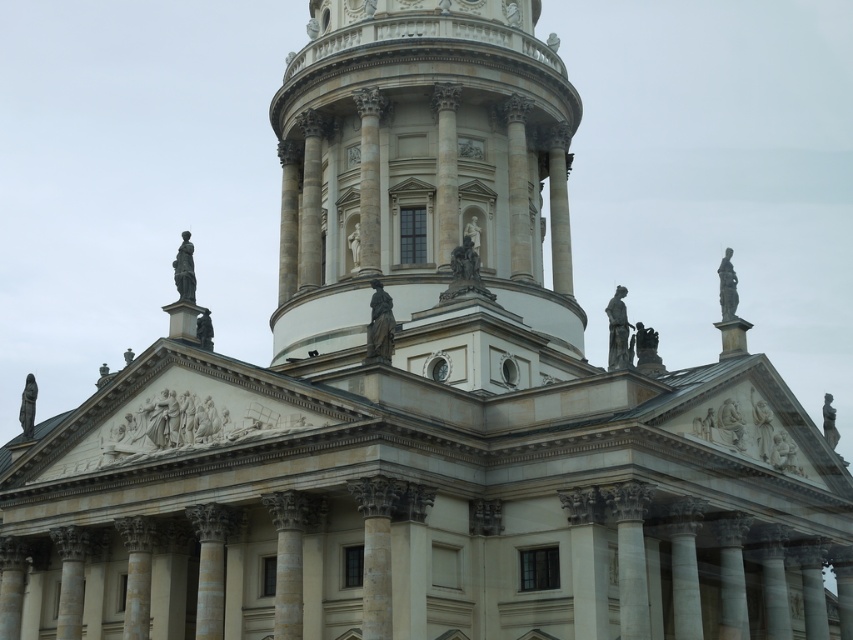
You are standing in front of the grand neoclassical building and want to take a photo of the polished bronze statue at center. If your camera can focus on objects up to 60 meters away, will it be able to capture the statue clearly?

The polished bronze statue at center is 66.27 meters away from camera, which is beyond the camera focus range of 60 meters. Therefore, the camera cannot capture the statue clearly.

You are an architect designing a new building inspired by this neoclassical structure. You want to place both the gray stone statue at center and the polished bronze statue at center on the facade. Which statue should be placed higher up to maintain the visual balance according to their sizes?

The gray stone statue at center should be placed higher up since it has a greater height compared to the polished bronze statue at center, aligning with its larger size for visual balance.